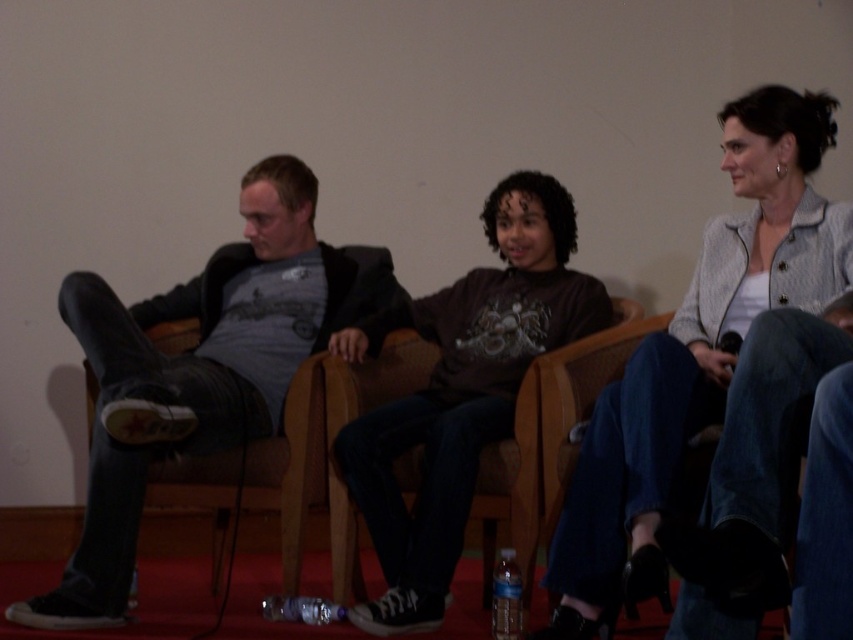
Does matte gray t-shirt at left lie in front of light gray textured blazer at upper right?

No, matte gray t-shirt at left is further to the viewer.

Is point (143, 342) closer to camera compared to point (788, 150)?

No, it is behind (788, 150).

This screenshot has width=853, height=640. What are the coordinates of `matte gray t-shirt at left` in the screenshot? It's located at (202, 369).

Is light gray textured blazer at upper right thinner than matte gray sweater at center?

Indeed, light gray textured blazer at upper right has a lesser width compared to matte gray sweater at center.

Based on the photo, can you confirm if light gray textured blazer at upper right is smaller than matte gray sweater at center?

Correct, light gray textured blazer at upper right occupies less space than matte gray sweater at center.

Does point (616, 422) come in front of point (485, 307)?

Yes, point (616, 422) is closer to viewer.

The width and height of the screenshot is (853, 640). I want to click on light gray textured blazer at upper right, so click(x=697, y=355).

In the scene shown: Is matte gray t-shirt at left smaller than matte gray sweater at center?

No, matte gray t-shirt at left is not smaller than matte gray sweater at center.

Is matte gray t-shirt at left wider than matte gray sweater at center?

Yes, matte gray t-shirt at left is wider than matte gray sweater at center.

Does point (170, 429) lie behind point (492, 326)?

No, (170, 429) is in front of (492, 326).

The image size is (853, 640). Identify the location of matte gray t-shirt at left. pos(202,369).